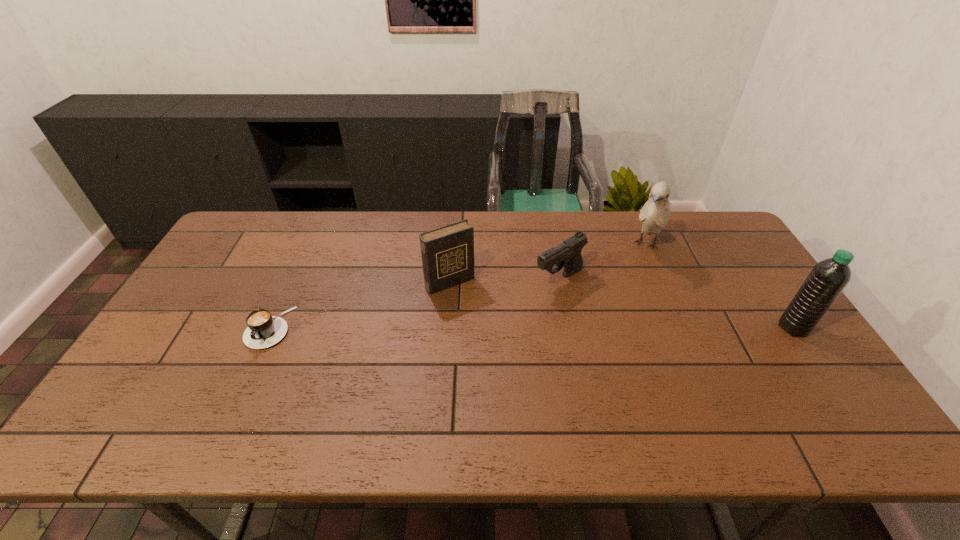
Where is `unoccupied area between the leftmost object and the third object from right to left`? The image size is (960, 540). unoccupied area between the leftmost object and the third object from right to left is located at coordinates (414, 303).

Find the location of `blank region between the third object from left to right and the cappuccino`. blank region between the third object from left to right and the cappuccino is located at coordinates (414, 303).

Locate an element on the screen. The width and height of the screenshot is (960, 540). free point between the second object from left to right and the second shortest object is located at coordinates (504, 281).

Where is `free space between the rightmost object and the leftmost object`? The width and height of the screenshot is (960, 540). free space between the rightmost object and the leftmost object is located at coordinates point(531,328).

Locate an element on the screen. This screenshot has height=540, width=960. free space that is in between the fourth object from left to right and the fourth tallest object is located at coordinates (x=603, y=262).

This screenshot has height=540, width=960. I want to click on object that is the fourth closest to the shortest object, so click(827, 279).

This screenshot has height=540, width=960. Identify the location of the third closest object to the fourth object from left to right. (447, 253).

Find the location of `free point that satisfies the following two spatial constraints: 1. on the back side of the diary; 2. on the left side of the third object from right to left`. free point that satisfies the following two spatial constraints: 1. on the back side of the diary; 2. on the left side of the third object from right to left is located at coordinates (450, 280).